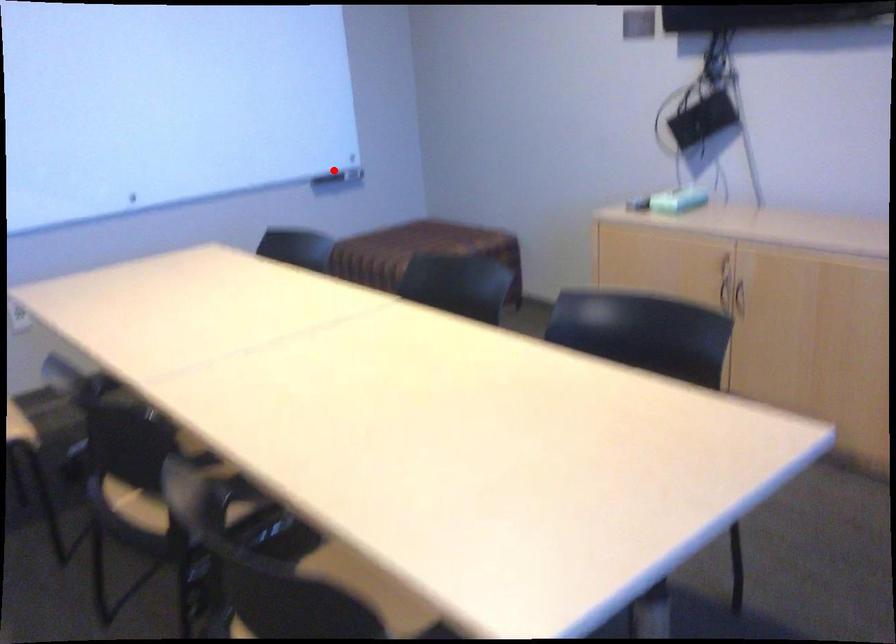
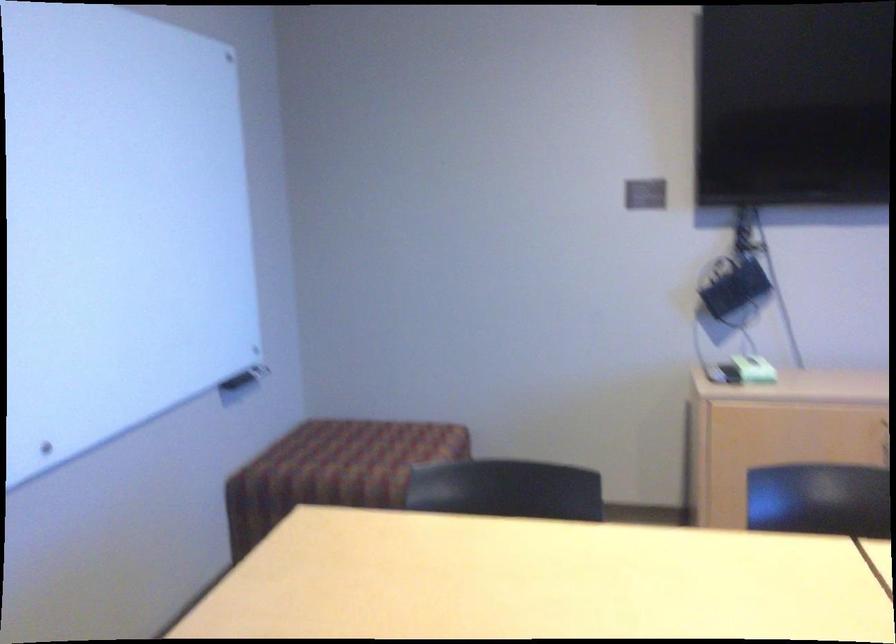
Locate, in the second image, the point that corresponds to the highlighted location in the first image.

(246, 373)